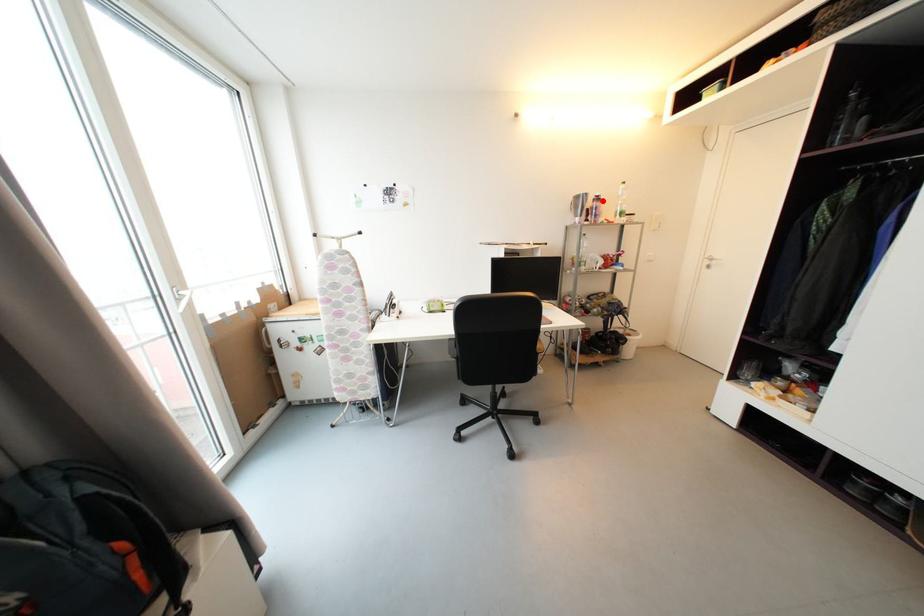
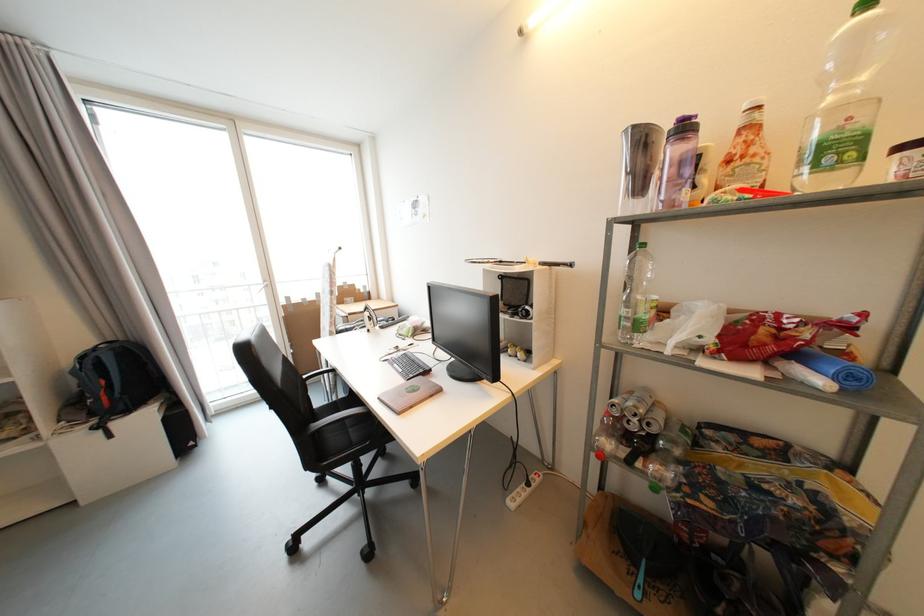
In the second image, find the point that corresponds to the highlighted location in the first image.

(689, 130)